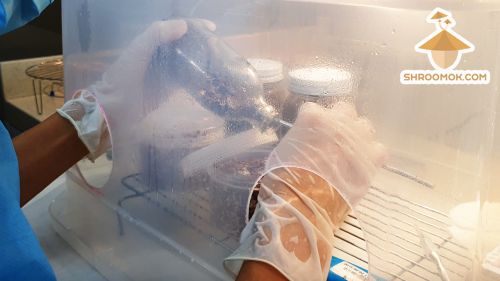
Locate an element on the screen. The image size is (500, 281). bottle is located at coordinates (215, 83).